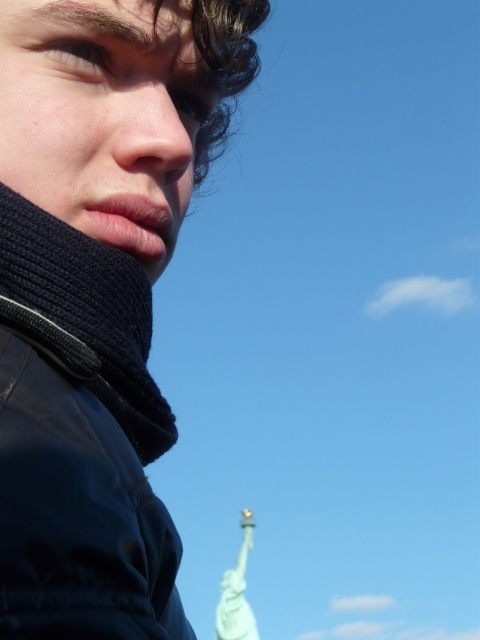
Does point (115, 502) come closer to viewer compared to point (115, 115)?

Yes, point (115, 502) is closer to viewer.

Does matte black scarf at lower left appear over smooth skin nose at center?

No, matte black scarf at lower left is not above smooth skin nose at center.

Image resolution: width=480 pixels, height=640 pixels. Describe the element at coordinates (92, 310) in the screenshot. I see `matte black scarf at lower left` at that location.

The width and height of the screenshot is (480, 640). I want to click on matte black scarf at lower left, so click(92, 310).